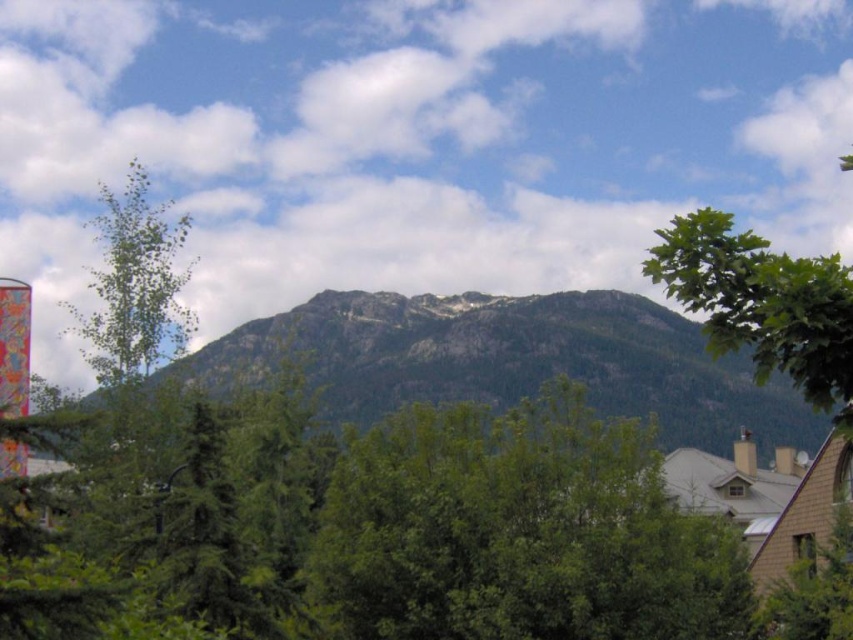
Does rocky gray mountain at center appear on the left side of green leafy tree at upper right?

Yes, rocky gray mountain at center is to the left of green leafy tree at upper right.

Describe the element at coordinates (509, 360) in the screenshot. I see `rocky gray mountain at center` at that location.

This screenshot has width=853, height=640. I want to click on rocky gray mountain at center, so click(x=509, y=360).

You are a GUI agent. You are given a task and a screenshot of the screen. Output one action in this format:
    pyautogui.click(x=<x>, y=<y>)
    Task: Click on the green leafy tree at center
    Image resolution: width=853 pixels, height=640 pixels.
    Given the screenshot: What is the action you would take?
    pyautogui.click(x=519, y=531)

Does green leafy tree at center appear on the right side of rocky gray mountain at center?

Correct, you'll find green leafy tree at center to the right of rocky gray mountain at center.

The height and width of the screenshot is (640, 853). Identify the location of green leafy tree at center. (519, 531).

Is point (451, 458) positioned after point (838, 413)?

Yes, it is.

Identify the location of green leafy tree at center. (519, 531).